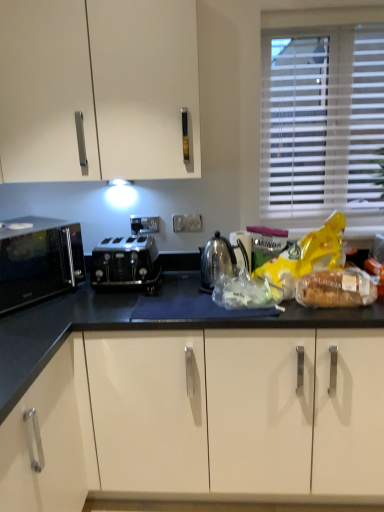
Question: Does satin silver toaster at center have a larger size compared to white blinds at upper right?

Choices:
 (A) yes
 (B) no

Answer: (B)

Question: Is satin silver toaster at center far from white blinds at upper right?

Choices:
 (A) yes
 (B) no

Answer: (B)

Question: Is satin silver toaster at center aimed at white blinds at upper right?

Choices:
 (A) yes
 (B) no

Answer: (B)

Question: From a real-world perspective, is satin silver toaster at center physically above white blinds at upper right?

Choices:
 (A) no
 (B) yes

Answer: (A)

Question: Is satin silver toaster at center to the left of white blinds at upper right from the viewer's perspective?

Choices:
 (A) yes
 (B) no

Answer: (A)

Question: Does satin silver toaster at center have a lesser height compared to white blinds at upper right?

Choices:
 (A) no
 (B) yes

Answer: (B)

Question: Is clear plastic bread at right facing towards satin silver kettle at center?

Choices:
 (A) no
 (B) yes

Answer: (A)

Question: From a real-world perspective, is clear plastic bread at right on top of satin silver kettle at center?

Choices:
 (A) no
 (B) yes

Answer: (A)

Question: Is clear plastic bread at right next to satin silver kettle at center and touching it?

Choices:
 (A) yes
 (B) no

Answer: (B)

Question: Is clear plastic bread at right located outside satin silver kettle at center?

Choices:
 (A) no
 (B) yes

Answer: (B)

Question: Is satin silver kettle at center surrounded by clear plastic bread at right?

Choices:
 (A) yes
 (B) no

Answer: (B)

Question: Is clear plastic bread at right at the left side of satin silver kettle at center?

Choices:
 (A) no
 (B) yes

Answer: (A)

Question: Considering the relative sizes of brown textured bread at right, marked as the 1th food in a right-to-left arrangement, and black matte microwave at left in the image provided, is brown textured bread at right, marked as the 1th food in a right-to-left arrangement, thinner than black matte microwave at left?

Choices:
 (A) yes
 (B) no

Answer: (A)